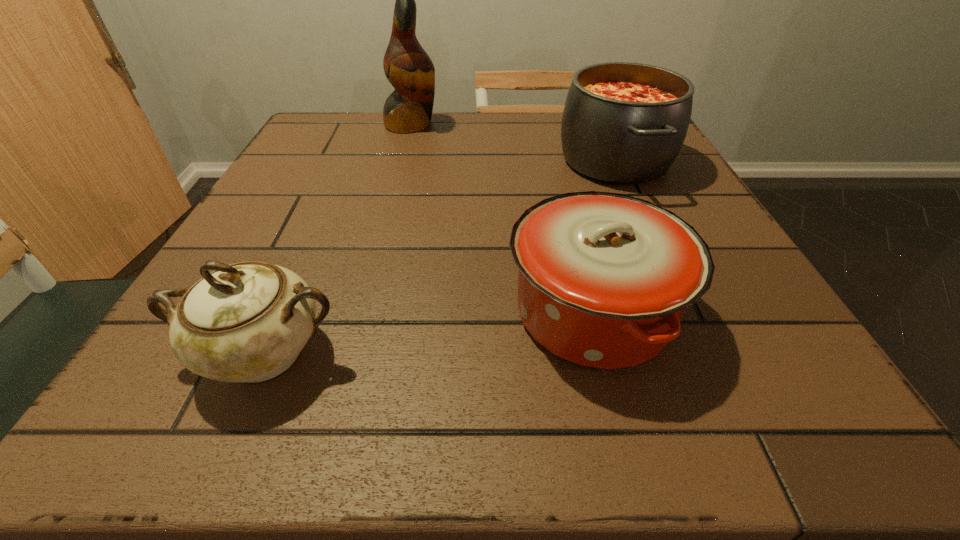
This screenshot has height=540, width=960. Identify the location of the closest object to the tallest object. (625, 123).

Locate which object is the second closest to the parrot. Please provide its 2D coordinates. Your answer should be formatted as a tuple, i.e. [(x, y)], where the tuple contains the x and y coordinates of a point satisfying the conditions above.

[(604, 278)]

Identify the location of free space that satisfies the following two spatial constraints: 1. on the back side of the farther casserole; 2. on the right side of the nearer casserole. (554, 160).

Image resolution: width=960 pixels, height=540 pixels. I want to click on free spot that satisfies the following two spatial constraints: 1. on the face of the parrot; 2. on the back side of the farther casserole, so click(401, 160).

Image resolution: width=960 pixels, height=540 pixels. Find the location of `free point that satisfies the following two spatial constraints: 1. on the face of the tallest object; 2. on the back side of the nearer casserole`. free point that satisfies the following two spatial constraints: 1. on the face of the tallest object; 2. on the back side of the nearer casserole is located at coordinates (361, 312).

The width and height of the screenshot is (960, 540). Identify the location of vacant space that satisfies the following two spatial constraints: 1. on the back side of the chinaware; 2. on the right side of the nearer casserole. (282, 312).

Find the location of a particular element. vacant space that satisfies the following two spatial constraints: 1. on the face of the parrot; 2. on the back side of the nearer casserole is located at coordinates (361, 312).

What are the coordinates of `free spot that satisfies the following two spatial constraints: 1. on the face of the parrot; 2. on the left side of the farther casserole` in the screenshot? It's located at (401, 160).